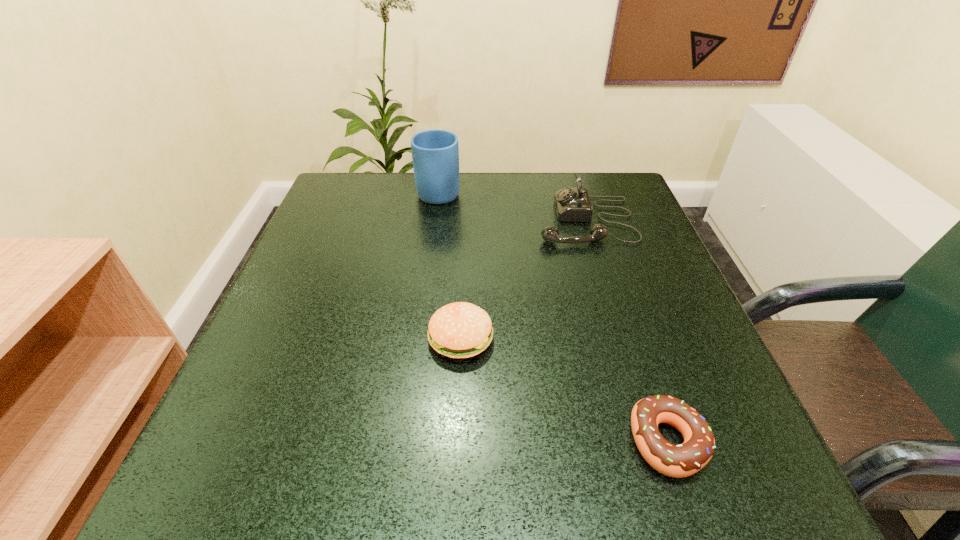
Find the location of a particular element. The height and width of the screenshot is (540, 960). mug is located at coordinates (435, 153).

Where is `telephone`? The width and height of the screenshot is (960, 540). telephone is located at coordinates (572, 204).

Locate an element on the screen. the third farthest object is located at coordinates (459, 330).

Find the location of a particular element. This screenshot has width=960, height=540. the nearest object is located at coordinates (683, 460).

Locate an element on the screen. the shortest object is located at coordinates (683, 460).

Find the location of `free space located 0.300m on the dial of the telephone`. free space located 0.300m on the dial of the telephone is located at coordinates pyautogui.click(x=407, y=221).

At what (x,y) coordinates should I click in order to perform the action: click on vacant space situated on the dial of the telephone. Please return your answer as a coordinate pair (x, y). This screenshot has height=540, width=960. Looking at the image, I should click on (416, 221).

Image resolution: width=960 pixels, height=540 pixels. What are the coordinates of `free region located 0.400m on the dial of the telephone` in the screenshot? It's located at (365, 221).

You are a GUI agent. You are given a task and a screenshot of the screen. Output one action in this format:
    pyautogui.click(x=<x>, y=<y>)
    Task: Click on the vacant position located 0.080m on the front of the second nearest object
    
    Given the screenshot: What is the action you would take?
    pyautogui.click(x=458, y=408)

I want to click on vacant region located 0.190m on the back of the doughnut, so click(626, 313).